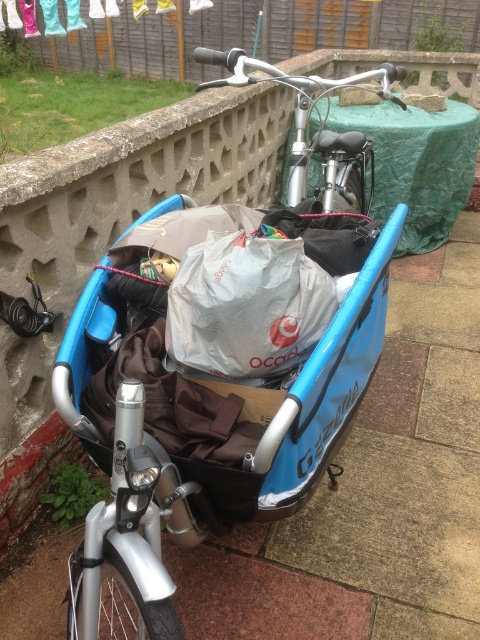
Is blue matte cargo bike at center thinner than silver metallic bicycle at upper center?

No.

Between blue matte cargo bike at center and silver metallic bicycle at upper center, which one has less height?

With less height is silver metallic bicycle at upper center.

Does point (347, 252) come behind point (348, 195)?

No, (347, 252) is in front of (348, 195).

Locate an element on the screen. blue matte cargo bike at center is located at coordinates (219, 365).